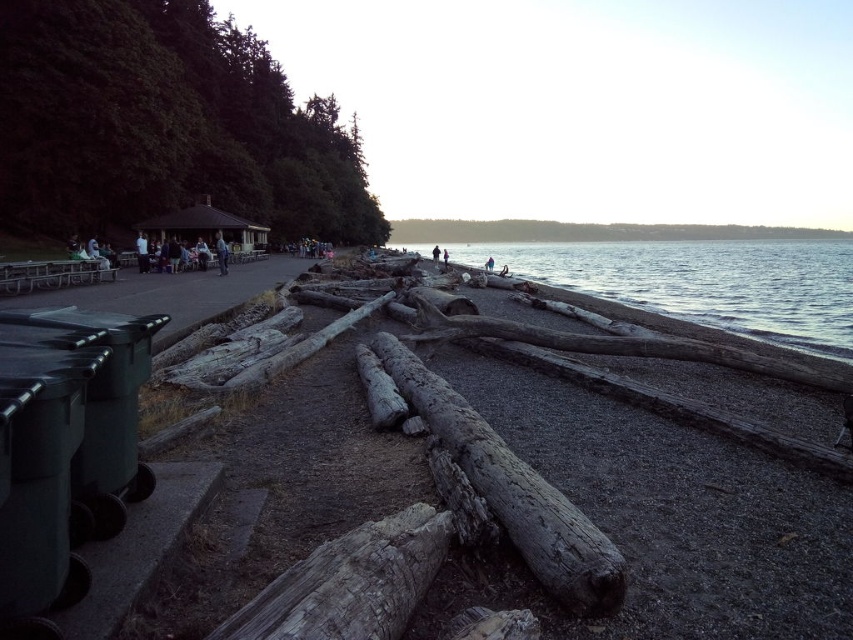
Question: Which of the following is the closest to the observer?

Choices:
 (A) (297, 584)
 (B) (578, 596)

Answer: (A)

Question: Estimate the real-world distances between objects in this image. Which object is closer to the weathered wood log at lower center?

Choices:
 (A) clear water at lower right
 (B) weathered wood log at center

Answer: (B)

Question: Does weathered wood log at center appear under weathered wood log at lower center?

Choices:
 (A) no
 (B) yes

Answer: (A)

Question: Does clear water at lower right have a lesser width compared to weathered wood log at center?

Choices:
 (A) yes
 (B) no

Answer: (B)

Question: Where is weathered wood log at center located in relation to weathered wood log at lower center in the image?

Choices:
 (A) left
 (B) right

Answer: (B)

Question: Which point is farther from the camera taking this photo?

Choices:
 (A) (407, 589)
 (B) (572, 260)
 (C) (593, 612)

Answer: (B)